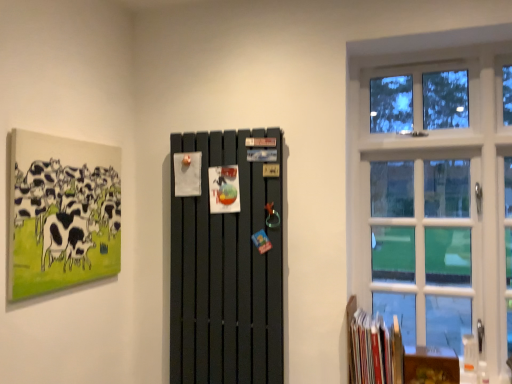
Question: Is matte canvas painting of cows at upper left wider than matte black radiator at center?

Choices:
 (A) yes
 (B) no

Answer: (B)

Question: Is matte canvas painting of cows at upper left smaller than matte black radiator at center?

Choices:
 (A) yes
 (B) no

Answer: (A)

Question: Can you confirm if matte canvas painting of cows at upper left is positioned to the left of matte black radiator at center?

Choices:
 (A) yes
 (B) no

Answer: (A)

Question: From the image's perspective, is matte canvas painting of cows at upper left located beneath matte black radiator at center?

Choices:
 (A) yes
 (B) no

Answer: (B)

Question: Is matte canvas painting of cows at upper left facing away from matte black radiator at center?

Choices:
 (A) yes
 (B) no

Answer: (B)

Question: Does matte canvas painting of cows at upper left have a greater height compared to matte black radiator at center?

Choices:
 (A) no
 (B) yes

Answer: (A)

Question: Would you consider white glass window at right to be distant from matte black radiator at center?

Choices:
 (A) yes
 (B) no

Answer: (B)

Question: Does white glass window at right have a larger size compared to matte black radiator at center?

Choices:
 (A) yes
 (B) no

Answer: (A)

Question: Can you confirm if white glass window at right is smaller than matte black radiator at center?

Choices:
 (A) yes
 (B) no

Answer: (B)

Question: Are white glass window at right and matte black radiator at center making contact?

Choices:
 (A) yes
 (B) no

Answer: (B)

Question: Considering the relative sizes of white glass window at right and matte black radiator at center in the image provided, is white glass window at right shorter than matte black radiator at center?

Choices:
 (A) yes
 (B) no

Answer: (B)

Question: From the image's perspective, does white glass window at right appear higher than matte black radiator at center?

Choices:
 (A) yes
 (B) no

Answer: (A)

Question: From the image's perspective, does hardcover books at lower right appear higher than white glass window at right?

Choices:
 (A) no
 (B) yes

Answer: (A)